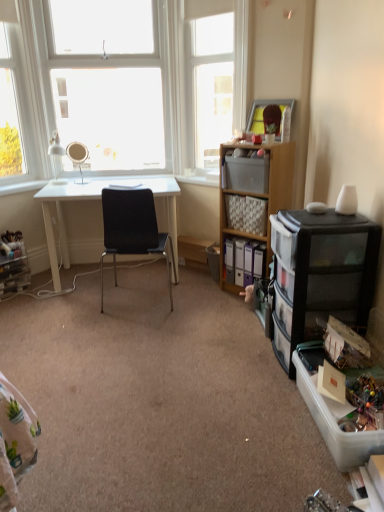
The image size is (384, 512). Identify the location of vacant space underneath white glass window at upper left, which is the 3th window in right-to-left order (from a real-world perspective). (23, 184).